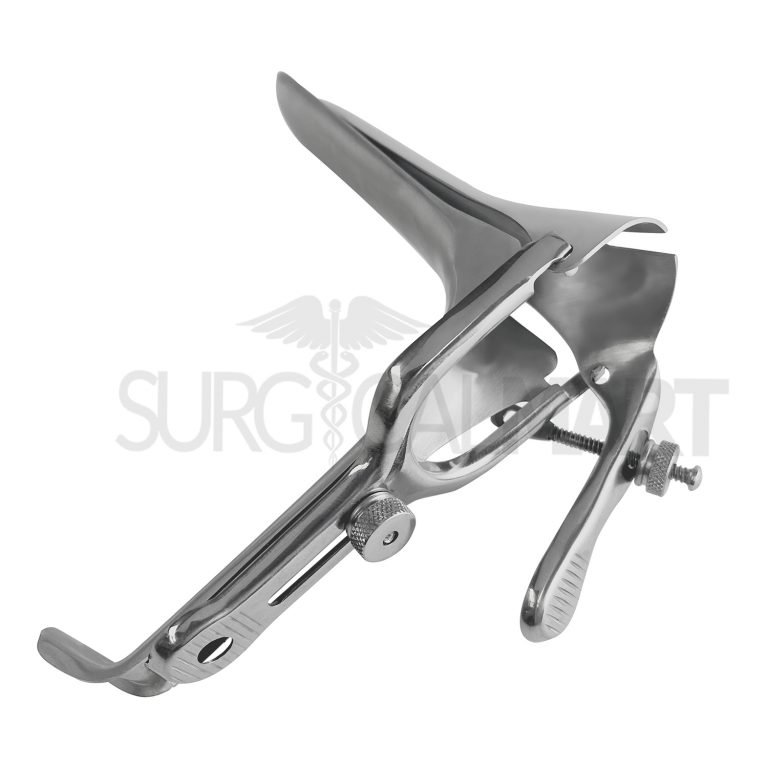
Locate an element on the screen. handle is located at coordinates (217, 634).